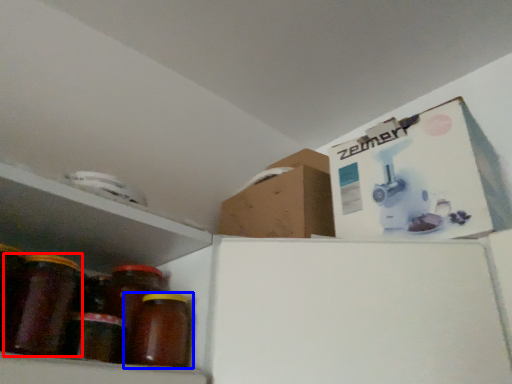
Question: Which object is closer to the camera taking this photo, bottle (highlighted by a red box) or bottle (highlighted by a blue box)?

Choices:
 (A) bottle
 (B) bottle

Answer: (A)